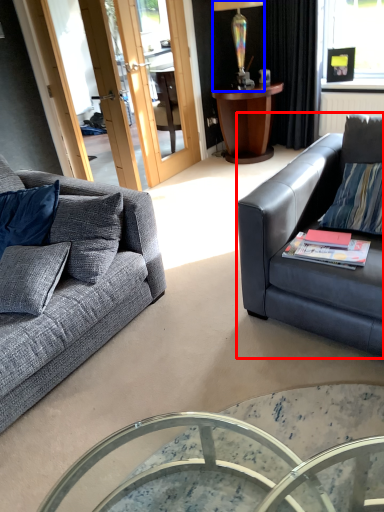
Question: Which point is further to the camera, studio couch (highlighted by a red box) or lamp (highlighted by a blue box)?

Choices:
 (A) studio couch
 (B) lamp

Answer: (B)